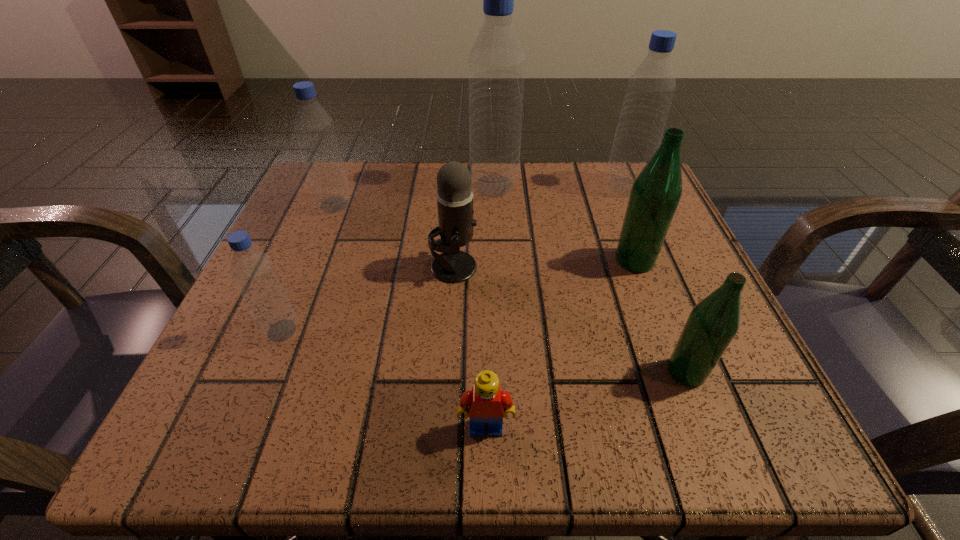
Image resolution: width=960 pixels, height=540 pixels. I want to click on object that is the fourth closest to the tallest object, so click(x=314, y=128).

Point out which object is positioned as the sixth nearest to the second smallest blue bottle. Please provide its 2D coordinates. Your answer should be formatted as a tuple, i.e. [(x, y)], where the tuple contains the x and y coordinates of a point satisfying the conditions above.

[(649, 93)]

Where is `the third closest bottle to the tallest object`? the third closest bottle to the tallest object is located at coordinates (314, 128).

At what (x,y) coordinates should I click in order to perform the action: click on bottle that is the second closest one to the tallest object. Please return your answer as a coordinate pair (x, y). Looking at the image, I should click on (656, 192).

At what (x,y) coordinates should I click in order to perform the action: click on the second closest blue bottle to the third biggest blue bottle. Please return your answer as a coordinate pair (x, y). The height and width of the screenshot is (540, 960). Looking at the image, I should click on (253, 271).

Point out which blue bottle is positioned as the second nearest to the fourth bottle from right to left. Please provide its 2D coordinates. Your answer should be formatted as a tuple, i.e. [(x, y)], where the tuple contains the x and y coordinates of a point satisfying the conditions above.

[(314, 128)]

In order to click on blank space that satisfies the following two spatial constraints: 1. on the front side of the seventh farthest object; 2. on the left side of the farther green bottle in this screenshot , I will do `click(677, 372)`.

Find the location of a particular element. vacant space that satisfies the following two spatial constraints: 1. on the back side of the second smallest blue bottle; 2. on the right side of the rightmost blue bottle is located at coordinates (342, 187).

Image resolution: width=960 pixels, height=540 pixels. I want to click on vacant space that satisfies the following two spatial constraints: 1. on the back side of the rightmost blue bottle; 2. on the left side of the nearest bottle, so click(613, 187).